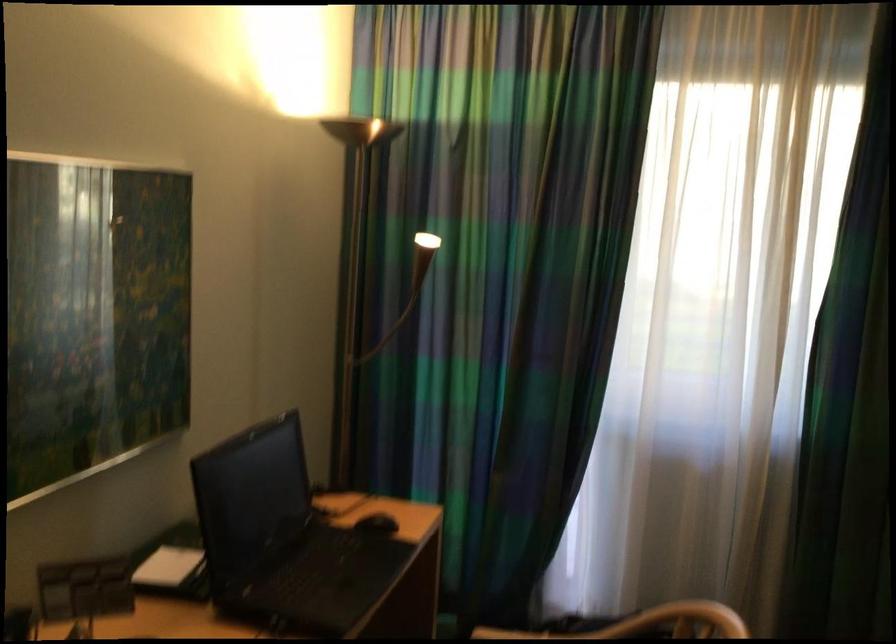
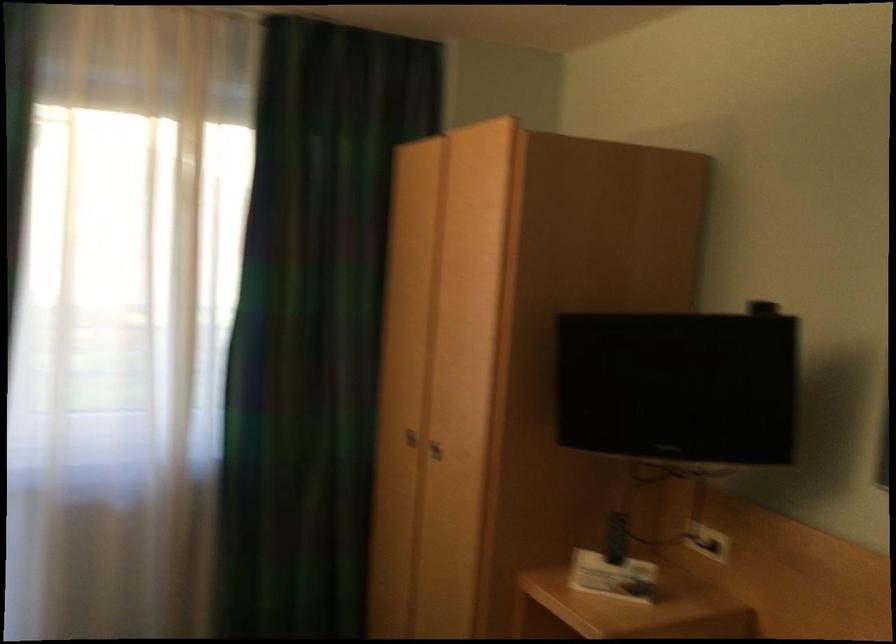
Question: The images are taken continuously from a first-person perspective. In which direction is your viewpoint rotating?

Choices:
 (A) Left
 (B) Right
 (C) Up
 (D) Down

Answer: (B)